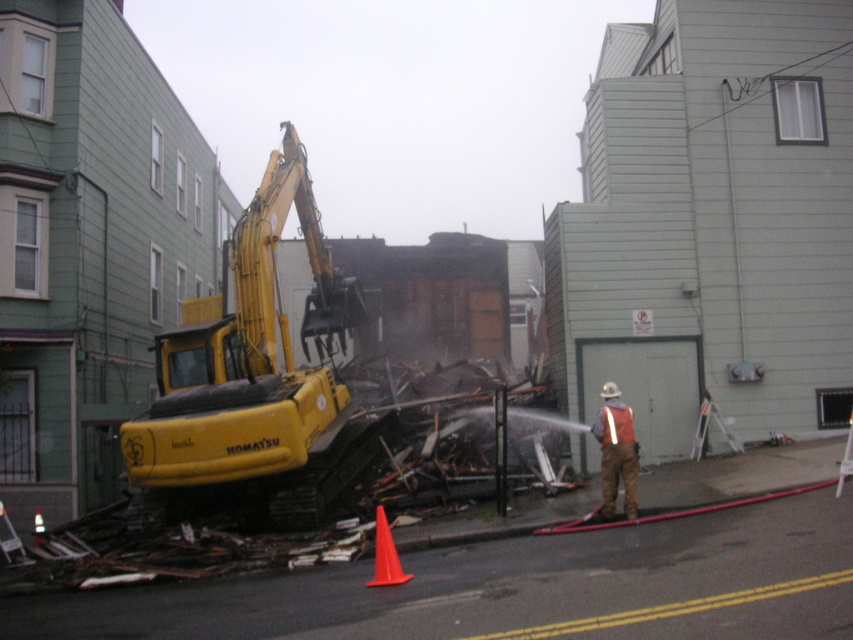
Looking at this image, does orange reflective vest at center appear under orange plastic cone at lower center?

No, orange reflective vest at center is not below orange plastic cone at lower center.

Is the position of orange reflective vest at center more distant than that of orange plastic cone at lower center?

Yes, orange reflective vest at center is behind orange plastic cone at lower center.

Image resolution: width=853 pixels, height=640 pixels. What do you see at coordinates (616, 451) in the screenshot?
I see `orange reflective vest at center` at bounding box center [616, 451].

Where is `orange reflective vest at center`? This screenshot has height=640, width=853. orange reflective vest at center is located at coordinates (616, 451).

Between yellow rubber excavator at left and orange plastic cone at lower center, which one appears on the left side from the viewer's perspective?

Positioned to the left is yellow rubber excavator at left.

Is yellow rubber excavator at left further to the viewer compared to orange plastic cone at lower center?

Yes, yellow rubber excavator at left is behind orange plastic cone at lower center.

Which is behind, point (263, 193) or point (374, 566)?

The point (263, 193) is behind.

Locate an element on the screen. yellow rubber excavator at left is located at coordinates (254, 376).

Which is in front, point (276, 204) or point (613, 480)?

Positioned in front is point (613, 480).

Between yellow rubber excavator at left and orange reflective vest at center, which one appears on the right side from the viewer's perspective?

From the viewer's perspective, orange reflective vest at center appears more on the right side.

Between point (317, 465) and point (624, 428), which one is positioned behind?

Point (317, 465)

The image size is (853, 640). What are the coordinates of `yellow rubber excavator at left` in the screenshot? It's located at (254, 376).